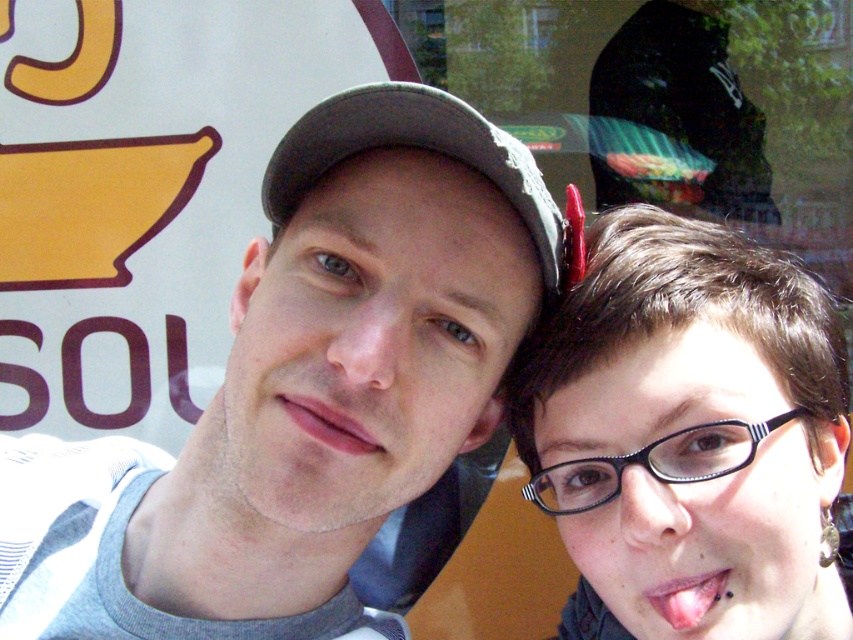
Which is behind, point (740, 592) or point (502, 172)?

Positioned behind is point (740, 592).

Can you confirm if black plastic glasses at right is positioned above gray fabric baseball cap at upper center?

No, black plastic glasses at right is not above gray fabric baseball cap at upper center.

Is point (567, 464) farther from viewer compared to point (521, 173)?

Yes, point (567, 464) is behind point (521, 173).

Find the location of a particular element. This screenshot has width=853, height=640. black plastic glasses at right is located at coordinates (688, 429).

Who is higher up, gray fabric baseball cap at upper center or pink matte lips at center?

gray fabric baseball cap at upper center is above.

Can you confirm if gray fabric baseball cap at upper center is shorter than pink matte lips at center?

Incorrect, gray fabric baseball cap at upper center's height does not fall short of pink matte lips at center's.

This screenshot has height=640, width=853. Describe the element at coordinates (412, 147) in the screenshot. I see `gray fabric baseball cap at upper center` at that location.

At what (x,y) coordinates should I click in order to perform the action: click on gray fabric baseball cap at upper center. Please return your answer as a coordinate pair (x, y). Looking at the image, I should click on (412, 147).

Does point (645, 289) come farther from viewer compared to point (648, 602)?

No, (645, 289) is closer to viewer.

Does black plastic glasses at right have a smaller size compared to pink flesh at center?

No, black plastic glasses at right is not smaller than pink flesh at center.

Is point (606, 560) behind point (701, 579)?

Yes, it is.

I want to click on black plastic glasses at right, so click(x=688, y=429).